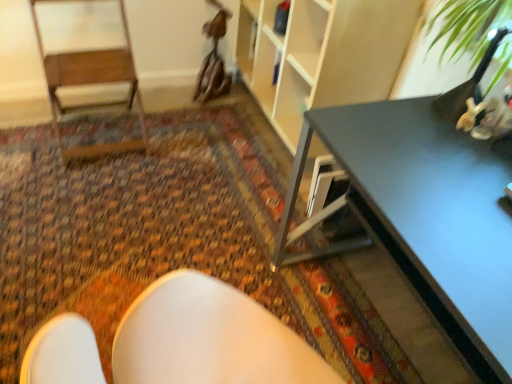
Question: Considering the relative positions of carpeted floor at center and matte black table at right in the image provided, is carpeted floor at center to the right of matte black table at right from the viewer's perspective?

Choices:
 (A) yes
 (B) no

Answer: (B)

Question: Is there a large distance between carpeted floor at center and matte black table at right?

Choices:
 (A) no
 (B) yes

Answer: (A)

Question: Is carpeted floor at center bigger than matte black table at right?

Choices:
 (A) no
 (B) yes

Answer: (A)

Question: From a real-world perspective, is carpeted floor at center located beneath matte black table at right?

Choices:
 (A) no
 (B) yes

Answer: (B)

Question: Could you tell me if carpeted floor at center is turned towards matte black table at right?

Choices:
 (A) yes
 (B) no

Answer: (B)

Question: Does carpeted floor at center come behind matte black table at right?

Choices:
 (A) no
 (B) yes

Answer: (B)

Question: From the image's perspective, does matte black table at right appear higher than carpeted floor at center?

Choices:
 (A) no
 (B) yes

Answer: (A)

Question: From a real-world perspective, is matte black table at right positioned over carpeted floor at center based on gravity?

Choices:
 (A) yes
 (B) no

Answer: (A)

Question: Considering the relative sizes of matte black table at right and carpeted floor at center in the image provided, is matte black table at right shorter than carpeted floor at center?

Choices:
 (A) yes
 (B) no

Answer: (B)

Question: Is matte black table at right positioned in front of carpeted floor at center?

Choices:
 (A) no
 (B) yes

Answer: (B)

Question: Is carpeted floor at center surrounded by matte black table at right?

Choices:
 (A) no
 (B) yes

Answer: (A)

Question: Can you confirm if matte black table at right is taller than carpeted floor at center?

Choices:
 (A) yes
 (B) no

Answer: (A)

Question: Can you confirm if carpeted floor at center is shorter than wooden armchair at left?

Choices:
 (A) yes
 (B) no

Answer: (A)